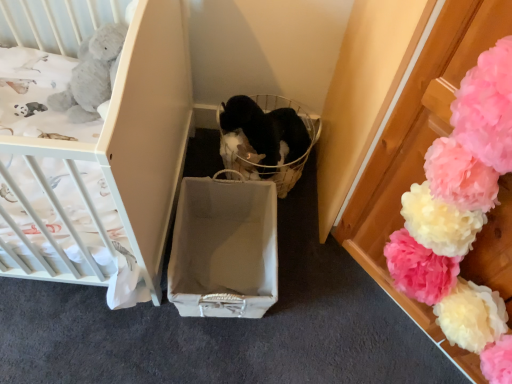
At what (x,y) coordinates should I click in order to perform the action: click on space that is in front of matte gray cardboard box at center. Please return your answer as a coordinate pair (x, y). The width and height of the screenshot is (512, 384). Looking at the image, I should click on (189, 353).